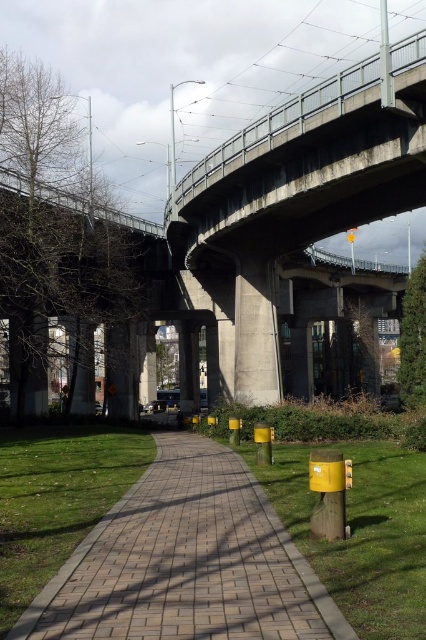
Question: Does brick paved walkway at center appear on the right side of metallic gray pole at upper right?

Choices:
 (A) no
 (B) yes

Answer: (A)

Question: Does brick paved walkway at center have a larger size compared to metallic gray pole at upper right?

Choices:
 (A) yes
 (B) no

Answer: (B)

Question: Among these objects, which one is nearest to the camera?

Choices:
 (A) metallic gray pole at upper right
 (B) brick paved walkway at center

Answer: (B)

Question: Is brick paved walkway at center above metallic gray pole at upper right?

Choices:
 (A) yes
 (B) no

Answer: (B)

Question: Which point is closer to the camera?

Choices:
 (A) (57, 576)
 (B) (393, 106)

Answer: (A)

Question: Which point appears farthest from the camera in this image?

Choices:
 (A) (72, 595)
 (B) (382, 56)

Answer: (B)